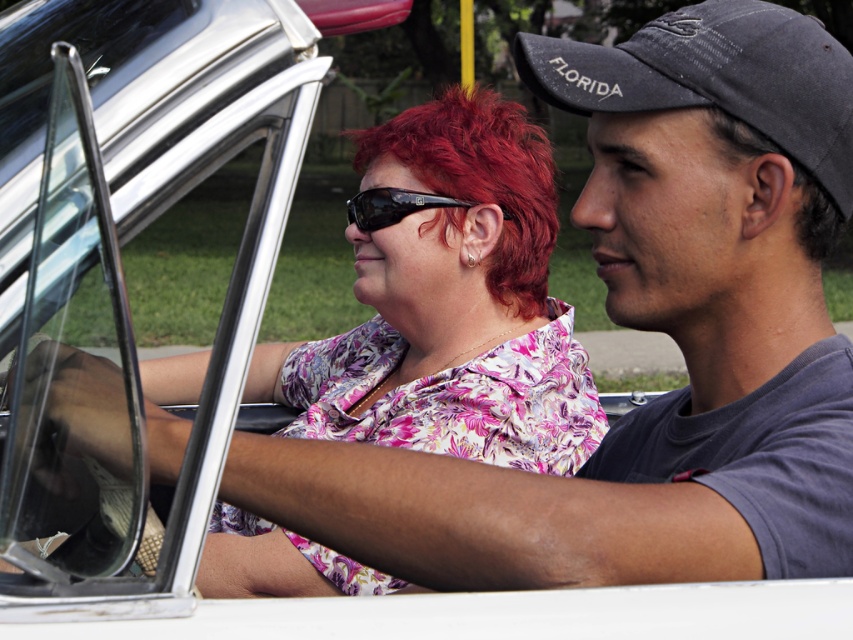
Question: Which of the following is the farthest from the observer?

Choices:
 (A) (202, 500)
 (B) (508, 108)
 (C) (825, 193)
 (D) (561, 100)

Answer: (B)

Question: Which object is the closest to the black reflective sunglasses at center?

Choices:
 (A) black fabric baseball cap at upper right
 (B) vivid red hair at center
 (C) clear glass window at center
 (D) dark brown curly hair at right

Answer: (B)

Question: Can you confirm if vivid red hair at center is positioned above dark brown curly hair at right?

Choices:
 (A) no
 (B) yes

Answer: (B)

Question: Is black fabric baseball cap at upper right behind black reflective sunglasses at center?

Choices:
 (A) no
 (B) yes

Answer: (A)

Question: Which point is closer to the camera taking this photo?

Choices:
 (A) (450, 198)
 (B) (830, 212)

Answer: (B)

Question: Is vivid red hair at center bigger than dark brown curly hair at right?

Choices:
 (A) no
 (B) yes

Answer: (B)